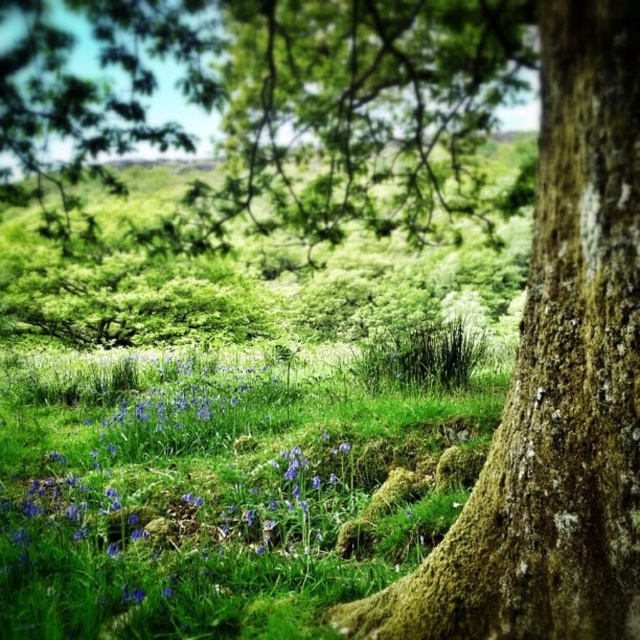
Who is taller, green grassy patch at center or mossy bark tree trunk at center-right?

Standing taller between the two is mossy bark tree trunk at center-right.

Does green grassy patch at center appear on the right side of mossy bark tree trunk at center-right?

Incorrect, green grassy patch at center is not on the right side of mossy bark tree trunk at center-right.

Describe the element at coordinates (216, 490) in the screenshot. I see `green grassy patch at center` at that location.

You are a GUI agent. You are given a task and a screenshot of the screen. Output one action in this format:
    pyautogui.click(x=<x>, y=<y>)
    Task: Click on the green grassy patch at center
    Image resolution: width=640 pixels, height=640 pixels.
    Given the screenshot: What is the action you would take?
    pos(216,490)

Who is more distant from viewer, (385, 145) or (468, 518)?

The point (385, 145) is more distant.

This screenshot has height=640, width=640. What do you see at coordinates (276, 100) in the screenshot?
I see `green mossy tree at center` at bounding box center [276, 100].

Find the location of a particular element. This screenshot has width=640, height=640. green mossy tree at center is located at coordinates [276, 100].

This screenshot has width=640, height=640. In order to click on green mossy tree at center in this screenshot , I will do `click(276, 100)`.

Does green grassy patch at center have a greater height compared to green mossy tree at center?

In fact, green grassy patch at center may be shorter than green mossy tree at center.

At what (x,y) coordinates should I click in order to perform the action: click on green grassy patch at center. Please return your answer as a coordinate pair (x, y). This screenshot has height=640, width=640. Looking at the image, I should click on (216, 490).

Who is more distant from viewer, [480,408] or [289,13]?

The point [289,13] is behind.

This screenshot has height=640, width=640. What are the coordinates of `green grassy patch at center` in the screenshot? It's located at pos(216,490).